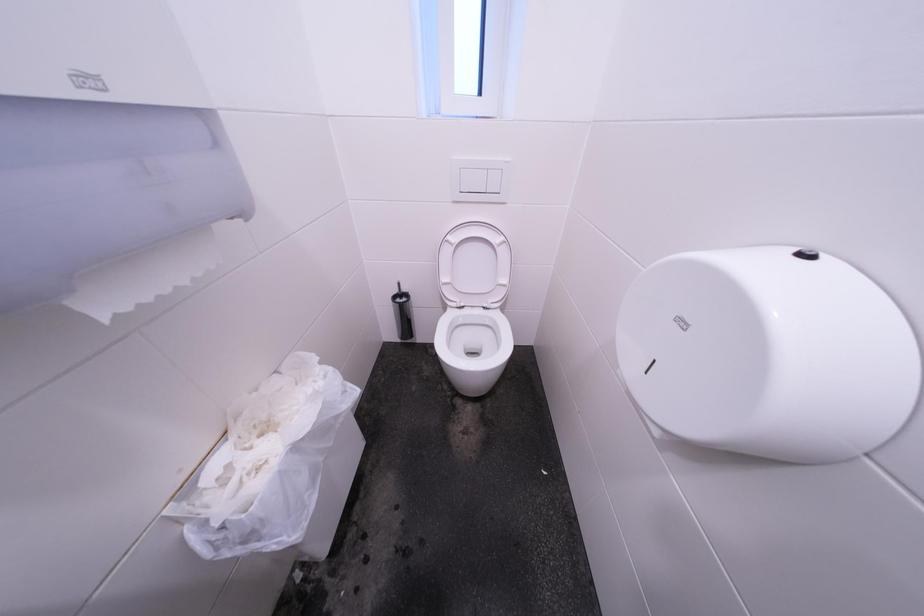
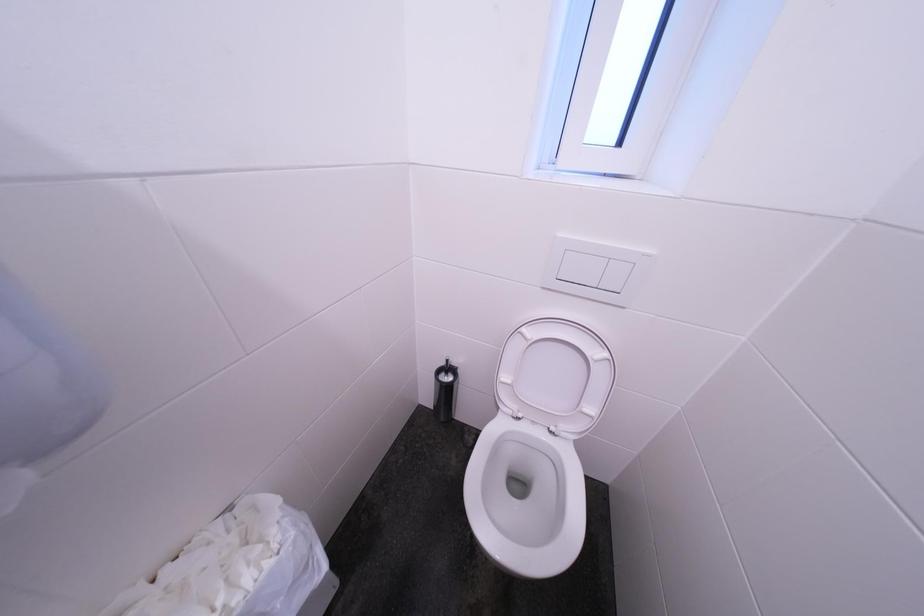
Question: What movement of the cameraman would produce the second image?

Choices:
 (A) Left
 (B) Right
 (C) Forward
 (D) Backward

Answer: (C)